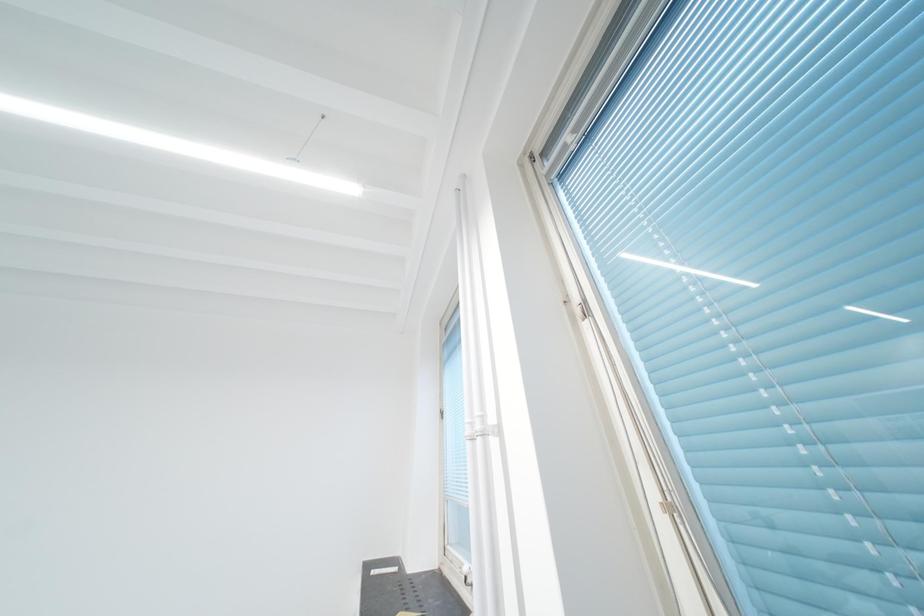
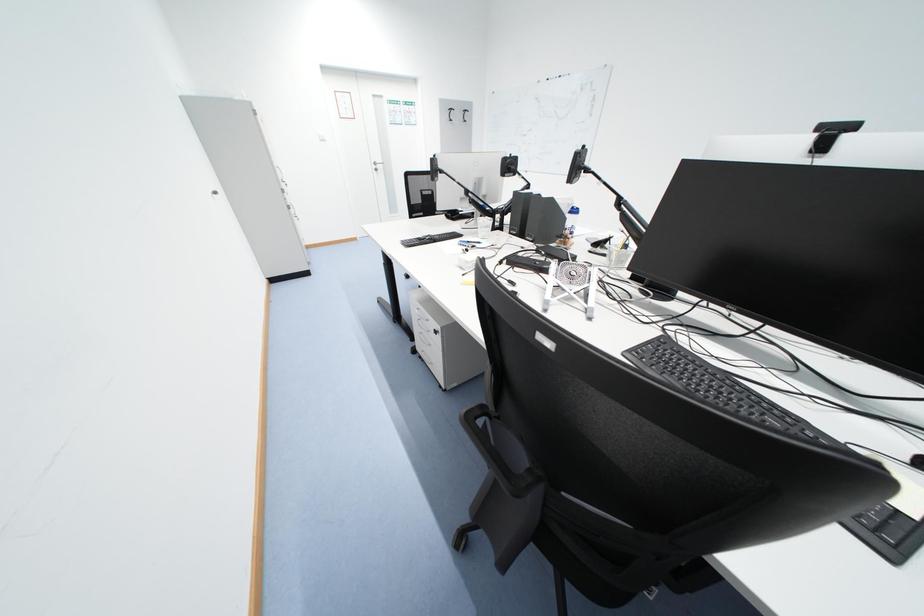
The images are taken continuously from a first-person perspective. In which direction is your viewpoint rotating?

The camera rotated toward left-down.